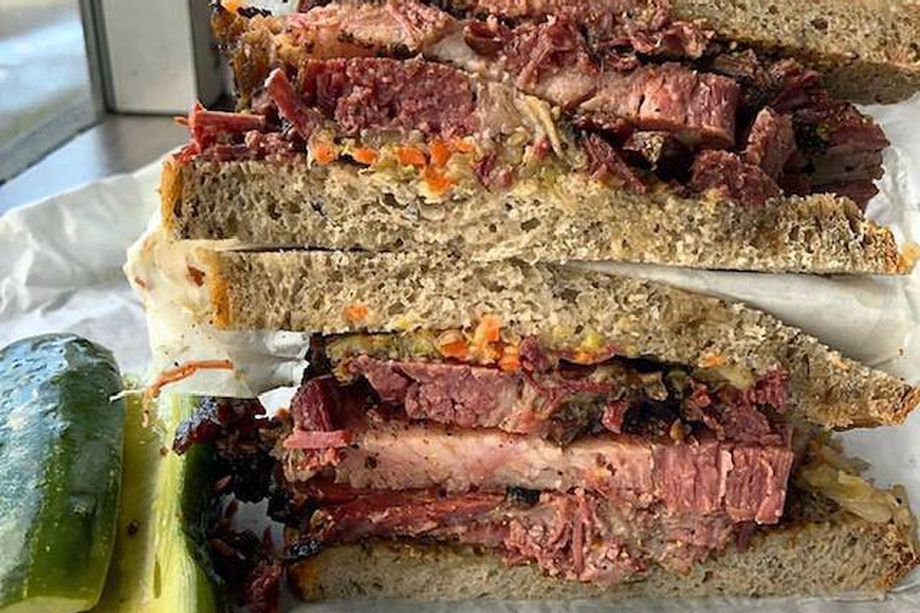
This screenshot has height=613, width=920. What are the coordinates of `wall` in the screenshot? It's located at (130, 39).